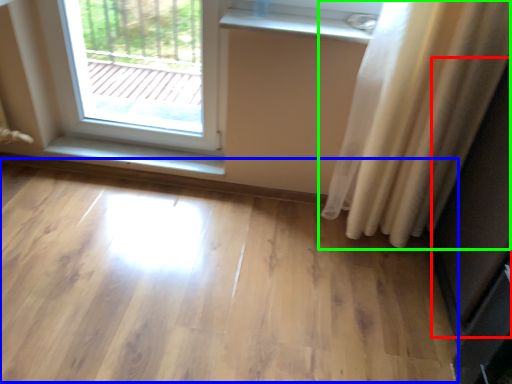
Question: Which object is positioned closest to screen door (highlighted by a red box)? Select from plain (highlighted by a blue box) and curtain (highlighted by a green box).

Choices:
 (A) plain
 (B) curtain

Answer: (B)